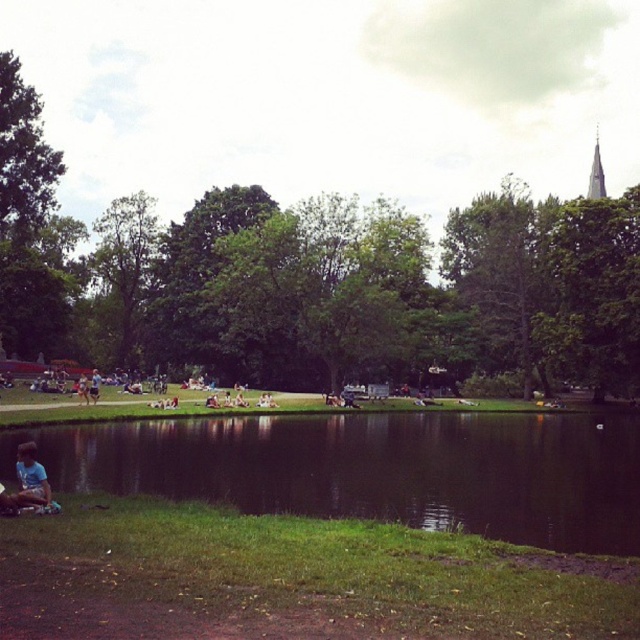
Can you confirm if light blue fabric shirt at lower left is thinner than gold textured spire at upper right?

Correct, light blue fabric shirt at lower left's width is less than gold textured spire at upper right's.

This screenshot has height=640, width=640. What do you see at coordinates (28, 483) in the screenshot?
I see `light blue fabric shirt at lower left` at bounding box center [28, 483].

The image size is (640, 640). What do you see at coordinates (28, 483) in the screenshot?
I see `light blue fabric shirt at lower left` at bounding box center [28, 483].

Identify the location of light blue fabric shirt at lower left. (28, 483).

Does green reflective water at lower center appear over gold textured spire at upper right?

Actually, green reflective water at lower center is below gold textured spire at upper right.

Where is `green reflective water at lower center`? The width and height of the screenshot is (640, 640). green reflective water at lower center is located at coordinates (374, 468).

Who is positioned more to the left, green reflective water at lower center or light blue fabric at lower left?

From the viewer's perspective, light blue fabric at lower left appears more on the left side.

Between green reflective water at lower center and light blue fabric at lower left, which one has less height?

light blue fabric at lower left is shorter.

Who is more distant from viewer, [625,426] or [93,401]?

The point [625,426] is more distant.

Where is `green reflective water at lower center`? green reflective water at lower center is located at coordinates (374, 468).